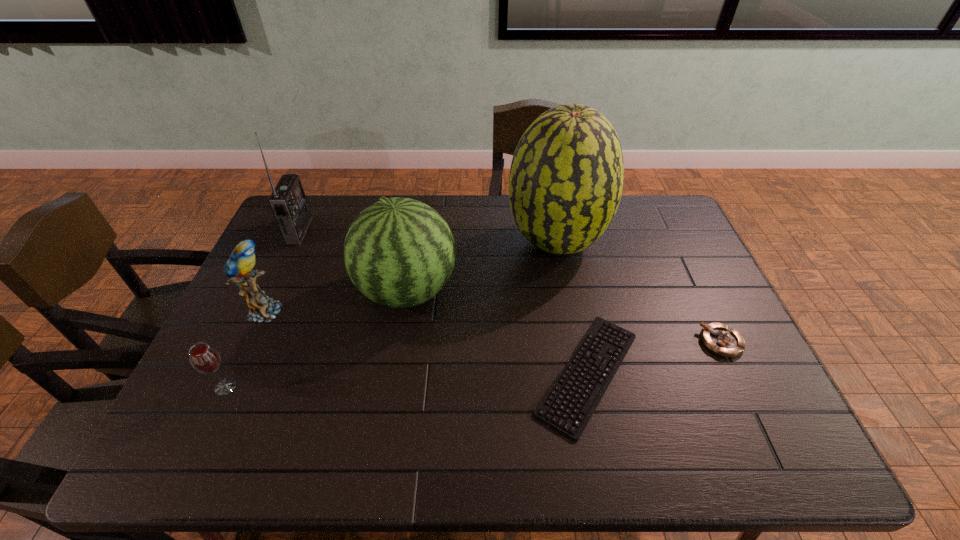
Where is `the sixth closest object to the radio receiver`? the sixth closest object to the radio receiver is located at coordinates [720, 339].

Locate which object is the closest to the shortest object. Please provide its 2D coordinates. Your answer should be formatted as a tuple, i.e. [(x, y)], where the tuple contains the x and y coordinates of a point satisfying the conditions above.

[(566, 178)]

This screenshot has height=540, width=960. In order to click on vacant position in the image that satisfies the following two spatial constraints: 1. on the display of the radio receiver; 2. on the front side of the third shortest object in this screenshot , I will do `click(228, 387)`.

The width and height of the screenshot is (960, 540). In order to click on vacant space that satisfies the following two spatial constraints: 1. on the front side of the taller watermelon; 2. on the face of the parrot in this screenshot , I will do `click(569, 311)`.

This screenshot has width=960, height=540. I want to click on free location that satisfies the following two spatial constraints: 1. on the face of the fourth shortest object; 2. on the right side of the rightmost object, so click(251, 342).